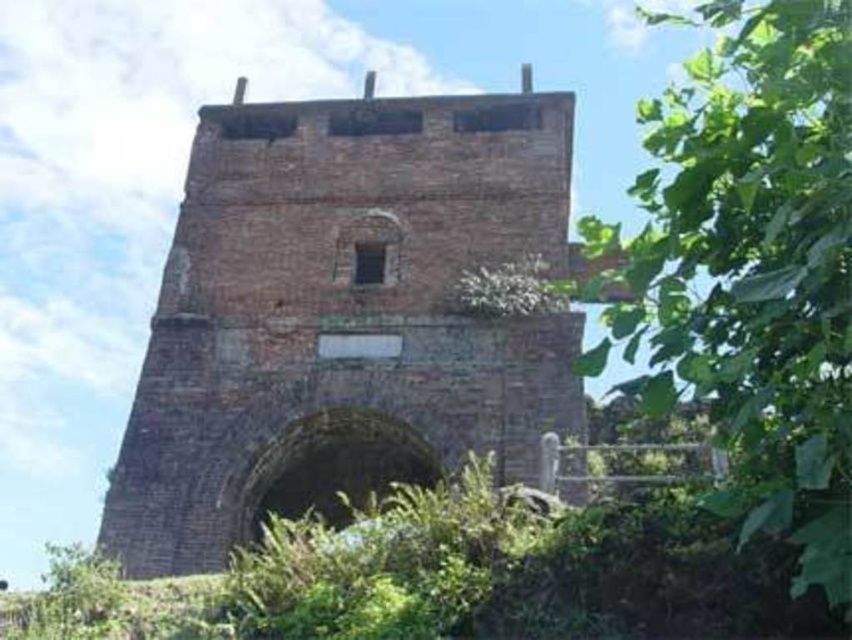
Question: Among these points, which one is nearest to the camera?

Choices:
 (A) (188, 364)
 (B) (756, 83)

Answer: (B)

Question: Can you confirm if brown brick tower at center is smaller than green leafy tree at right?

Choices:
 (A) yes
 (B) no

Answer: (A)

Question: Is brown brick tower at center bigger than green leafy tree at right?

Choices:
 (A) yes
 (B) no

Answer: (B)

Question: Does brown brick tower at center have a smaller size compared to green leafy tree at right?

Choices:
 (A) yes
 (B) no

Answer: (A)